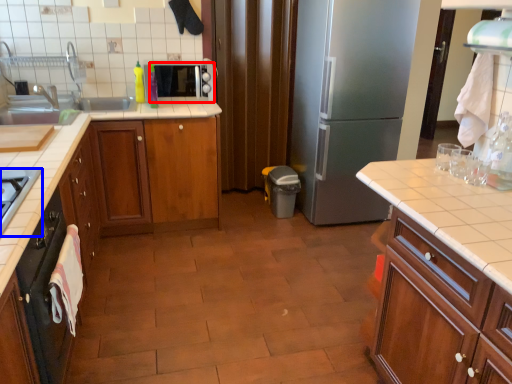
Question: Which object appears closest to the camera in this image, appliance (highlighted by a red box) or gas stove (highlighted by a blue box)?

Choices:
 (A) appliance
 (B) gas stove

Answer: (B)